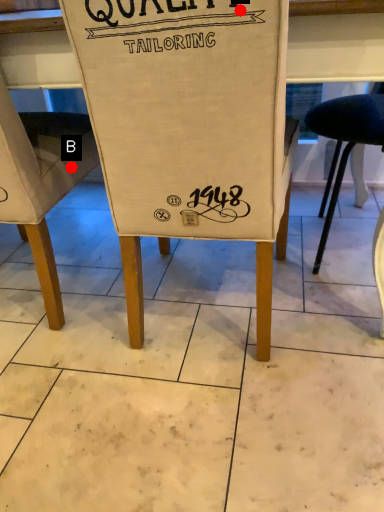
Question: Two points are circled on the image, labeled by A and B beside each circle. Which of the following is the farthest from the observer?

Choices:
 (A) A is further
 (B) B is further

Answer: (B)